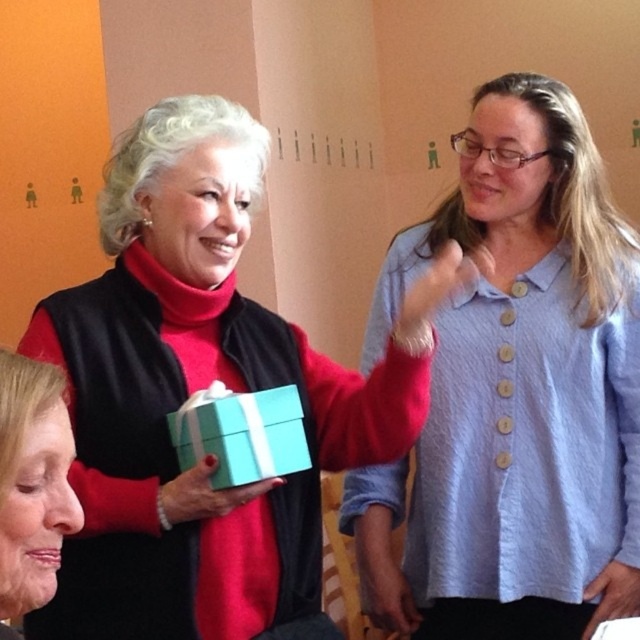
You are a photographer trying to capture a photo of the matte blue box at center and the blue textured shirt at upper right. Which object is positioned higher in the image?

The matte blue box at center is located above the blue textured shirt at upper right, so it is positioned higher in the image.

You are a delivery person who needs to place a matte blue box at center on a table that has coordinates from 0.5 to 0.7 in the x and 0.2 to 0.4 in the y. Will the box fit on the table?

The matte blue box at center is located at point (202,388), which falls within the table coordinates of x 0.5 to 0.7 and y 0.2 to 0.4. Therefore, the box will fit on the table.